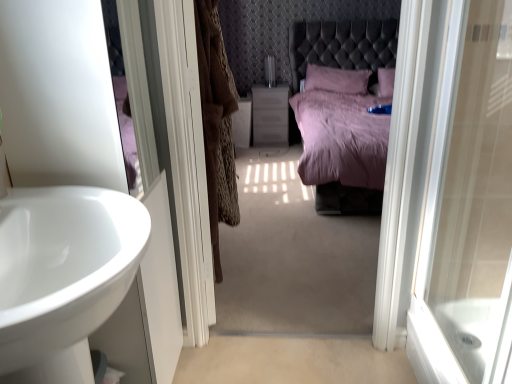
Question: Is white glossy door at right in front of or behind brown fur coat at center in the image?

Choices:
 (A) behind
 (B) front

Answer: (B)

Question: From a real-world perspective, is white glossy door at right positioned above or below brown fur coat at center?

Choices:
 (A) above
 (B) below

Answer: (B)

Question: Based on their relative distances, which object is nearer to the white glossy door at right?

Choices:
 (A) white glossy screen door at center
 (B) brown fur coat at center
 (C) white glossy sink at left
 (D) matte plastic vanity at center

Answer: (A)

Question: Estimate the real-world distances between objects in this image. Which object is closer to the white glossy sink at left?

Choices:
 (A) white glossy door at right
 (B) matte plastic vanity at center
 (C) white glossy screen door at center
 (D) brown fur coat at center

Answer: (C)